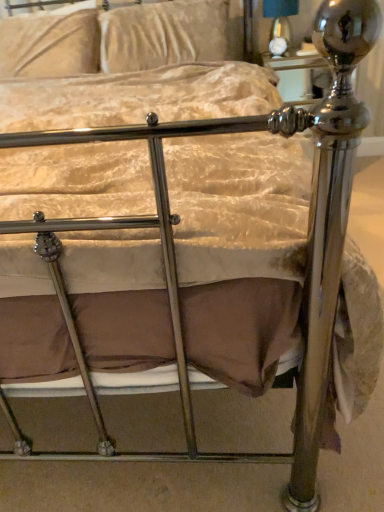
Question: Is matte black lampshade at upper center to the left or to the right of velvet beige pillow at upper left, the second pillow viewed from the right, in the image?

Choices:
 (A) right
 (B) left

Answer: (A)

Question: From a real-world perspective, relative to velvet beige pillow at upper left, the second pillow viewed from the right, is matte black lampshade at upper center vertically above or below?

Choices:
 (A) below
 (B) above

Answer: (A)

Question: Considering the real-world distances, which object is farthest from the matte black lampshade at upper center?

Choices:
 (A) velvet beige pillow at upper left, the second pillow viewed from the right
 (B) velvet beige pillow at upper center, which is the first pillow in right-to-left order

Answer: (A)

Question: Estimate the real-world distances between objects in this image. Which object is farther from the velvet beige pillow at upper center, which is the first pillow in right-to-left order?

Choices:
 (A) velvet beige pillow at upper left, the second pillow viewed from the right
 (B) matte black lampshade at upper center

Answer: (B)